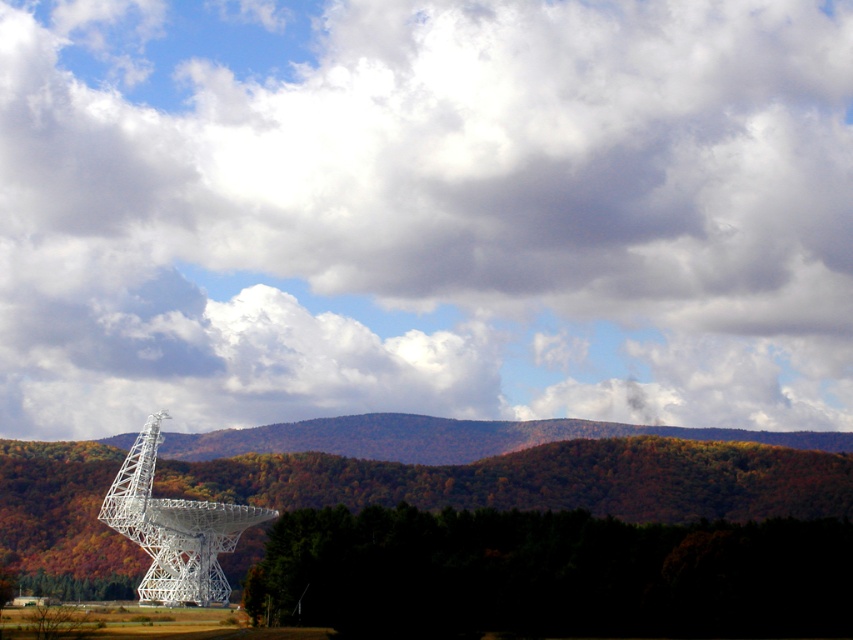
You are an astronomer observing the cloudy sky at upper center and the white metallic satellite at center. Which object is located higher in the image?

The cloudy sky at upper center is positioned over the white metallic satellite at center, so it is higher in the image.

You are an astronomer observing the sky through the telescope. You notice the cloudy sky at upper center and the white metallic satellite at center. Which one is higher in the sky?

The cloudy sky at upper center has a greater height compared to the white metallic satellite at center, so the cloudy sky at upper center is higher in the sky.

You are an astronomer observing the night sky through the telescope. You notice the cloudy sky at upper center and the white metallic satellite at center. Which of these two objects appears bigger in the sky from your observation point?

The cloudy sky at upper center appears bigger than the white metallic satellite at center because it has a larger size compared to the satellite.